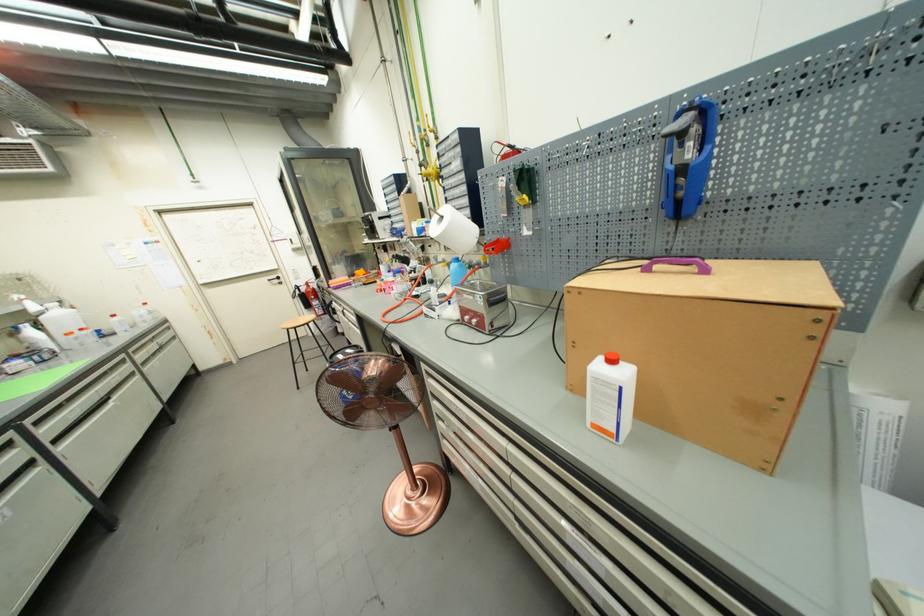
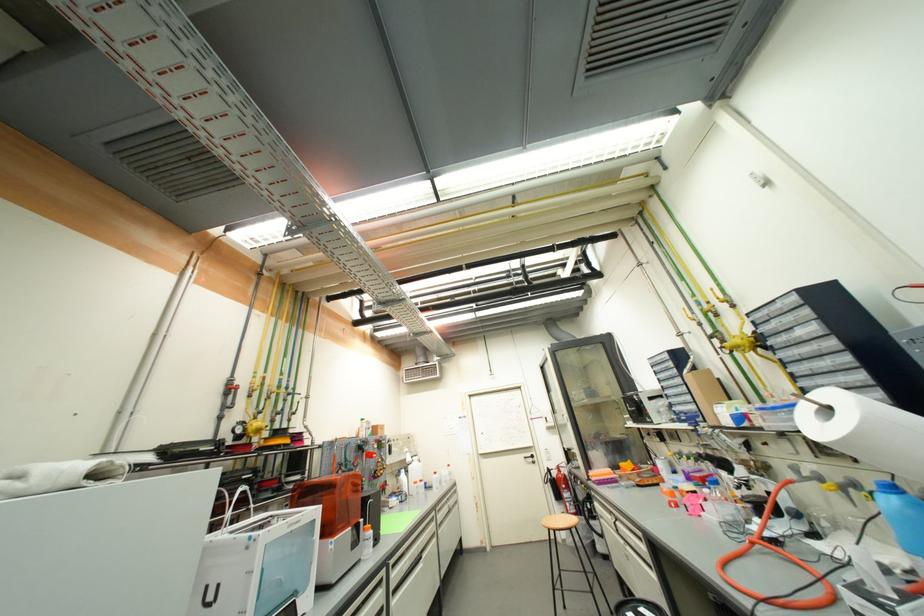
In the second image, find the point that corresponds to point 353,323 in the first image.

(627, 543)